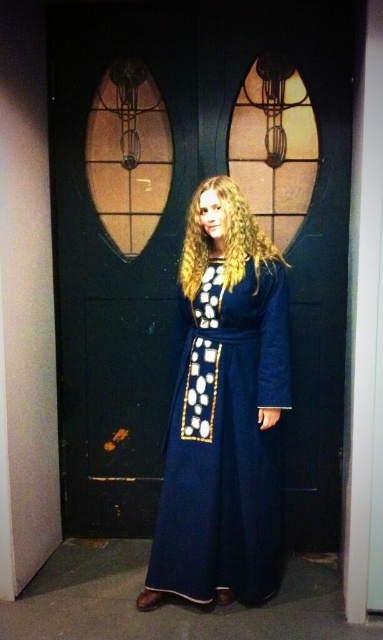
You are a tailor measuring the width of the velvet blue robe at center and the golden curly hair at center. Which object has a greater width?

The velvet blue robe at center might be wider than golden curly hair at center, so the robe likely has a greater width.

You are a tailor measuring the distance between the velvet blue robe at center and the golden curly hair at center for a costume design. Can you fit a 10 inch decorative sash between them?

The distance between the velvet blue robe at center and the golden curly hair at center is 9.77 inches, so a 10 inch decorative sash would not fit between them as it is slightly longer than the available space.

You are a photographer trying to capture the person in the scene. Since the velvet blue robe at center and the golden curly hair at center are both at the center, which one will appear larger in your photo?

The velvet blue robe at center will appear larger in the photo because it is closer to the viewer than the golden curly hair at center.